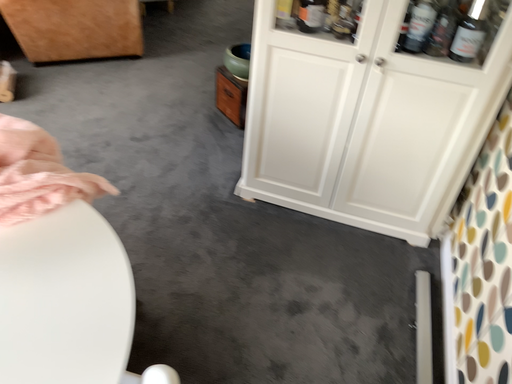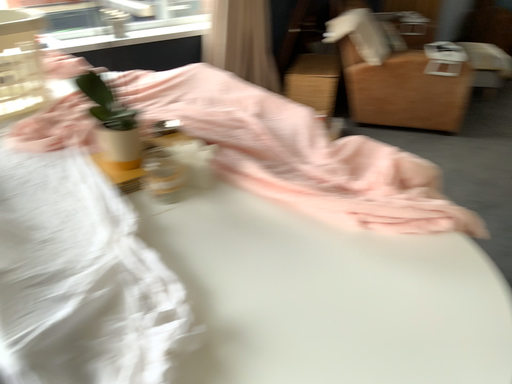
Question: Which way did the camera rotate in the video?

Choices:
 (A) rotated left
 (B) rotated right

Answer: (A)